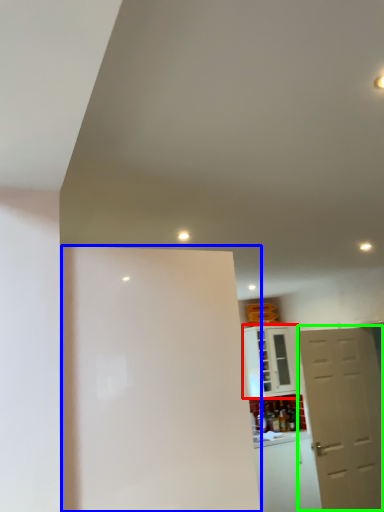
Question: Estimate the real-world distances between objects in this image. Which object is farther from cabinetry (highlighted by a red box), screen door (highlighted by a blue box) or door (highlighted by a green box)?

Choices:
 (A) screen door
 (B) door

Answer: (A)